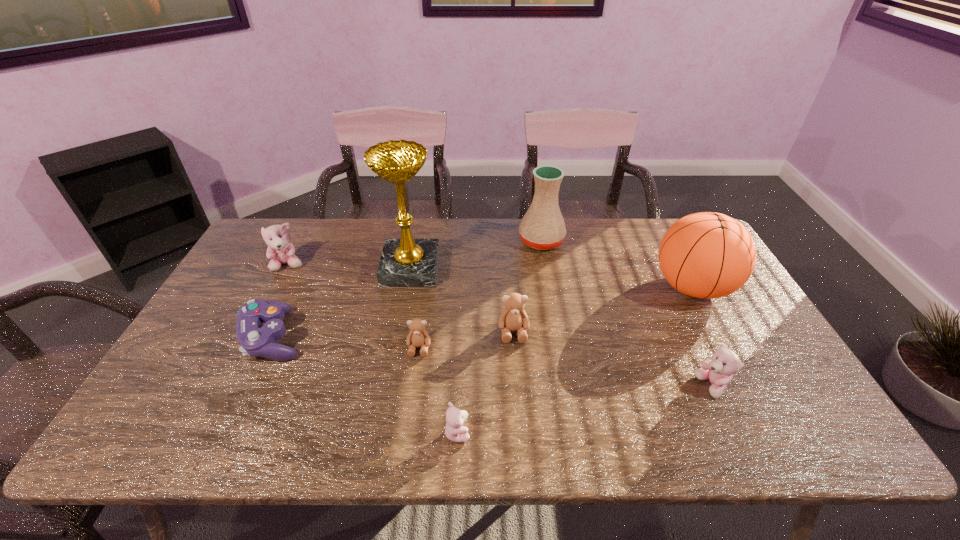
You are a GUI agent. You are given a task and a screenshot of the screen. Output one action in this format:
    pyautogui.click(x=<x>, y=<y>)
    Task: Click on the purple control
    This screenshot has height=540, width=960.
    Given the screenshot: What is the action you would take?
    pyautogui.click(x=256, y=339)

Image resolution: width=960 pixels, height=540 pixels. In order to click on the smaller brown teddy bear in this screenshot , I will do `click(418, 337)`.

Locate an element on the screen. This screenshot has width=960, height=540. the fourth teddy bear from right to left is located at coordinates (418, 337).

This screenshot has height=540, width=960. Find the location of `the nearest pink teddy bear`. the nearest pink teddy bear is located at coordinates (455, 431).

Where is `the nearest teddy bear`? the nearest teddy bear is located at coordinates (455, 431).

Find the location of a particular element. vacant space located 0.110m on the front-facing side of the gold award is located at coordinates (472, 269).

Identify the location of free space located on the back of the pottery. Image resolution: width=960 pixels, height=540 pixels. (538, 218).

Image resolution: width=960 pixels, height=540 pixels. I want to click on vacant space located 0.210m on the back of the basketball, so click(x=659, y=224).

Identify the location of blank space located at the face of the biggest pink teddy bear. The width and height of the screenshot is (960, 540). (232, 375).

Locate an element on the screen. Image resolution: width=960 pixels, height=540 pixels. vacant region located on the face of the fourth teddy bear from left to right is located at coordinates (522, 449).